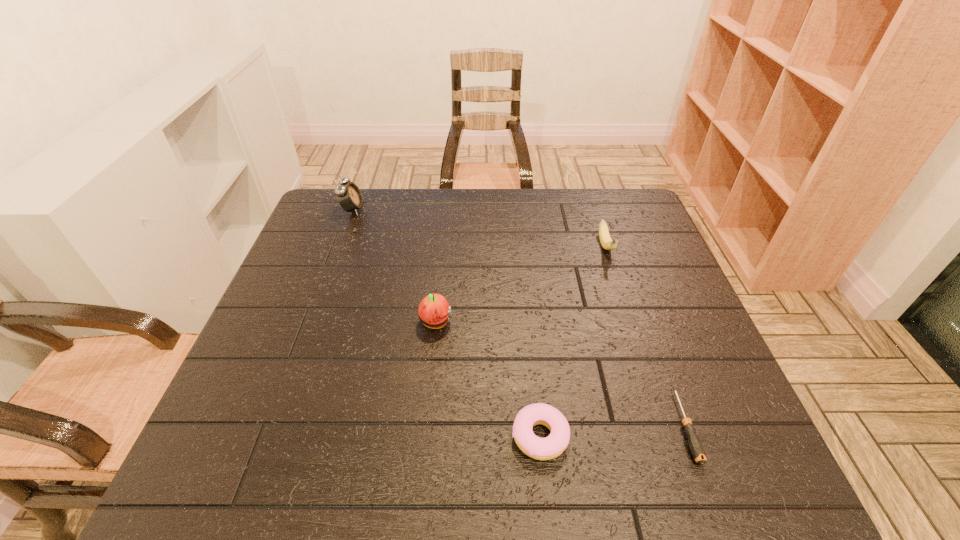
Find the location of a particular element. free space at the near left corner of the desktop is located at coordinates (224, 490).

Image resolution: width=960 pixels, height=540 pixels. In order to click on blank space at the far right corner of the desktop in this screenshot , I will do `click(615, 215)`.

This screenshot has height=540, width=960. Identify the location of vacant area that lies between the farthest object and the second farthest object. pos(479,228).

Identify the location of vacant point located between the fourth object from left to right and the farthest object. This screenshot has width=960, height=540. (479, 228).

Locate an element on the screen. empty location between the rightmost object and the banana is located at coordinates (645, 336).

You are a GUI agent. You are given a task and a screenshot of the screen. Output one action in this format:
    pyautogui.click(x=<x>, y=<y>)
    Task: Click on the free area in between the fourth object from left to right and the apple
    Image resolution: width=960 pixels, height=540 pixels.
    Given the screenshot: What is the action you would take?
    pyautogui.click(x=520, y=285)

Find the location of a particular element. The image size is (960, 540). empty space between the farthest object and the apple is located at coordinates (395, 266).

Identify the location of vacant point located between the third farthest object and the farthest object. Image resolution: width=960 pixels, height=540 pixels. (395, 266).

Find the location of a particular element. unoccupied position between the rightmost object and the third object from left to right is located at coordinates (612, 431).

Where is `free spot between the third farthest object and the doughnut`? free spot between the third farthest object and the doughnut is located at coordinates (488, 380).